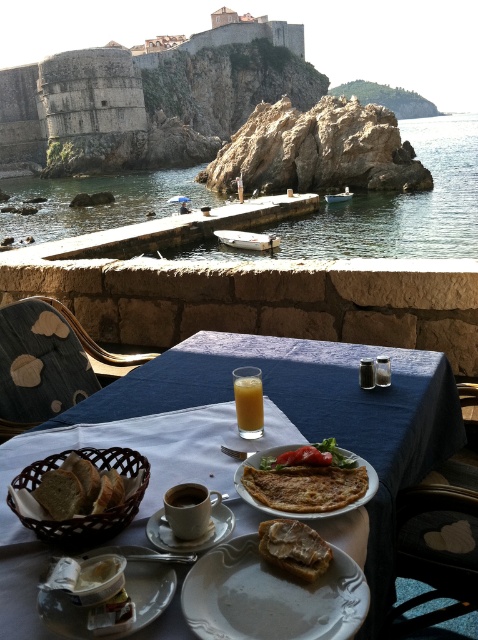
Question: Observing the image, what is the correct spatial positioning of blue fabric table at center in reference to clear water at dock center?

Choices:
 (A) above
 (B) below

Answer: (B)

Question: Which point is farther to the camera?

Choices:
 (A) white bread at center
 (B) white matte plate at lower center

Answer: (A)

Question: Which point is farther to the camera?

Choices:
 (A) white bread at center
 (B) clear water at dock center
 (C) translucent glass at center
 (D) golden brown bread at center

Answer: (B)

Question: Among these objects, which one is farthest from the camera?

Choices:
 (A) clear water at dock center
 (B) white matte plate at lower center

Answer: (A)

Question: Is denim fabric chair at left closer to camera compared to translucent glass at center?

Choices:
 (A) no
 (B) yes

Answer: (A)

Question: Can you confirm if white ceramic plate at lower center is positioned to the right of white bread at center?

Choices:
 (A) no
 (B) yes

Answer: (B)